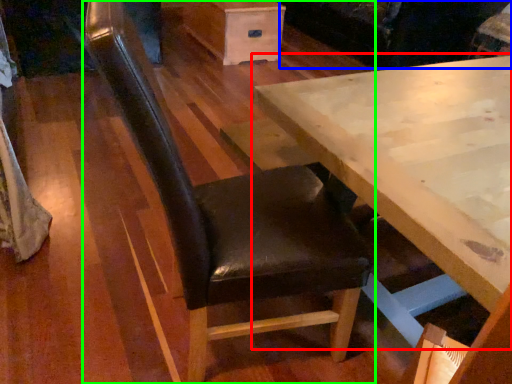
Question: Which is nearer to the table (highlighted by a red box)? couch (highlighted by a blue box) or chair (highlighted by a green box).

Choices:
 (A) couch
 (B) chair

Answer: (B)